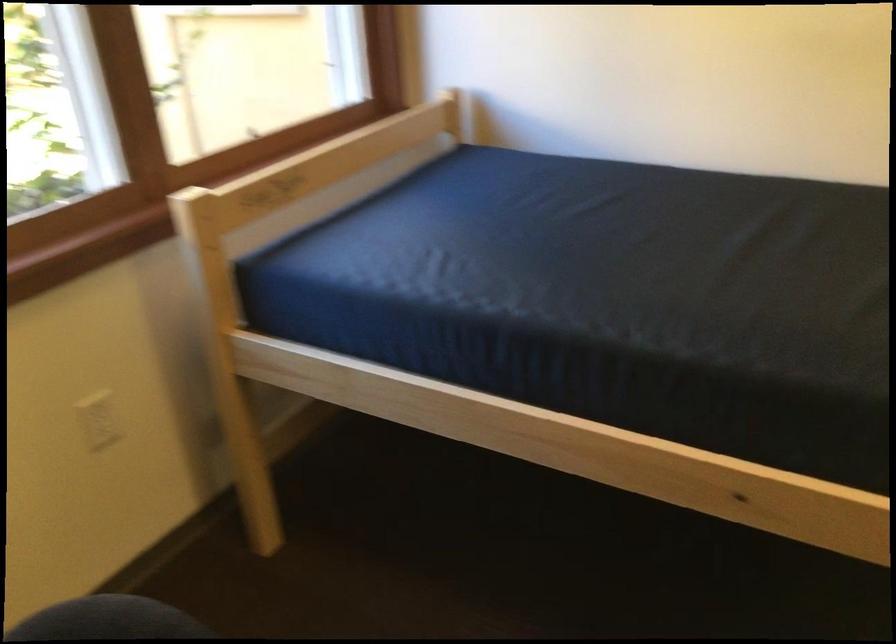
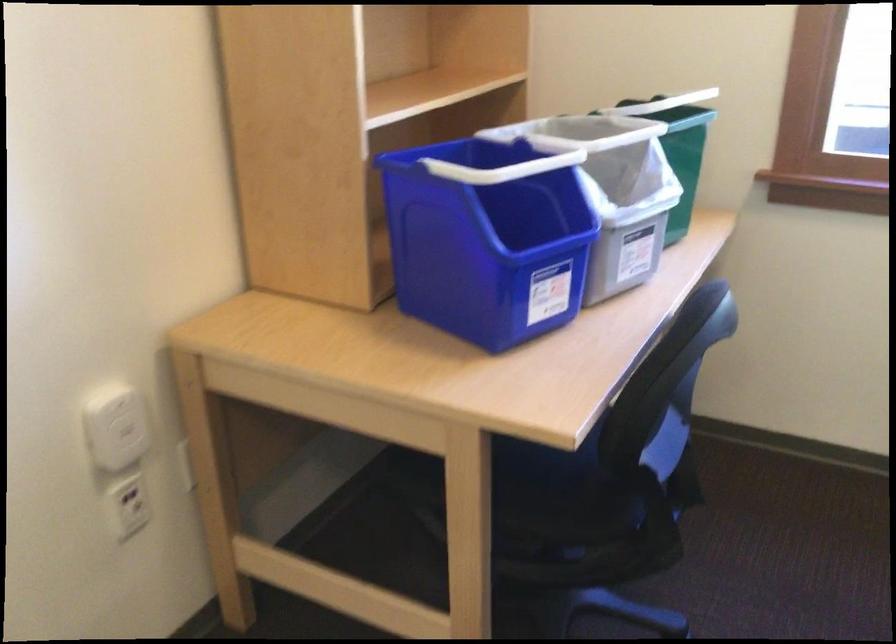
Based on the continuous images, in which direction is the camera rotating?

The camera's rotation is toward left-down.